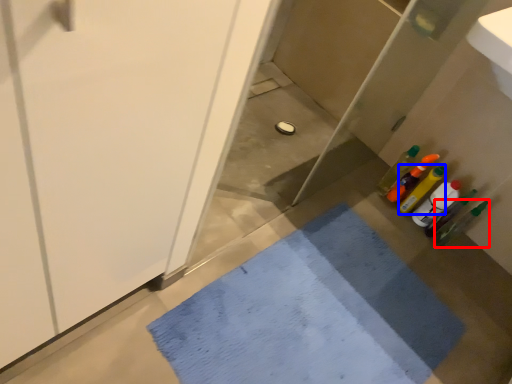
Question: Which of the following is the farthest to the observer, bottle (highlighted by a red box) or bottle (highlighted by a blue box)?

Choices:
 (A) bottle
 (B) bottle

Answer: (B)